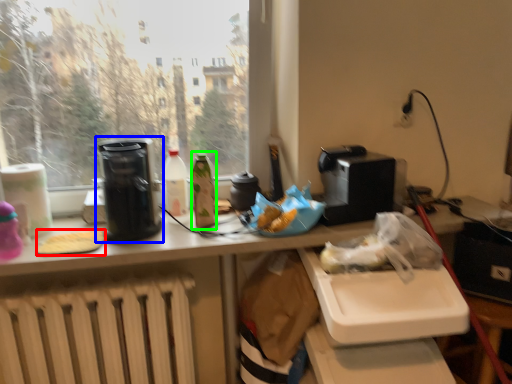
Question: Which object is positioned farthest from food (highlighted by a red box)? Select from kitchen appliance (highlighted by a blue box) and bottle (highlighted by a green box).

Choices:
 (A) kitchen appliance
 (B) bottle

Answer: (B)